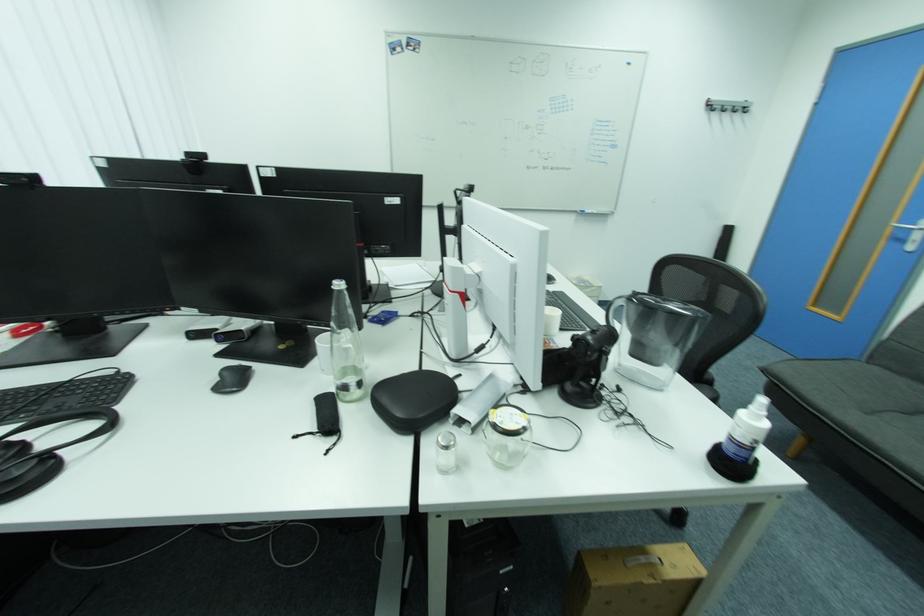
Identify the location of black zippered case. This screenshot has height=616, width=924. (414, 400).